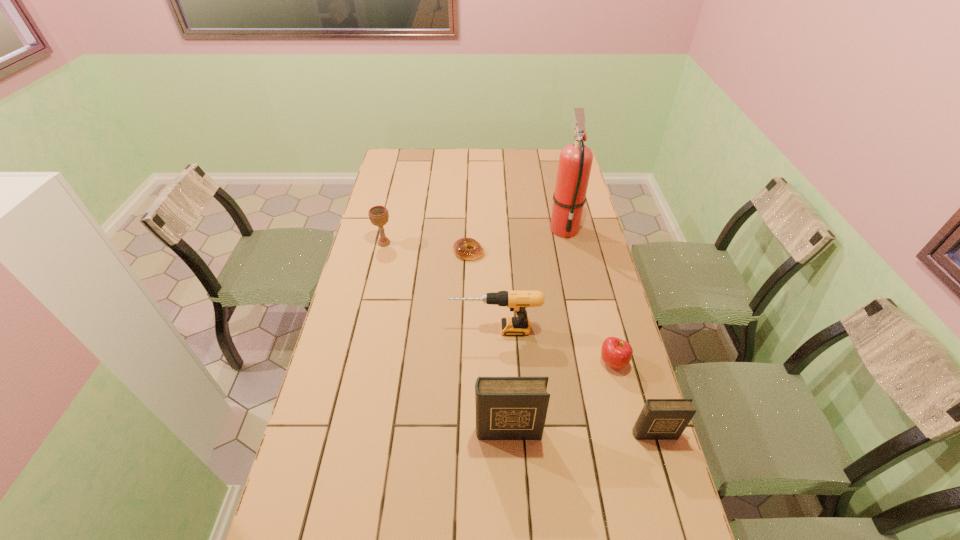
Image resolution: width=960 pixels, height=540 pixels. Identify the location of free space located on the front cover of the right diary. (682, 528).

Image resolution: width=960 pixels, height=540 pixels. Identify the location of vacant space located 0.160m on the right of the bagel. (526, 252).

Locate an element on the screen. free spot located on the hose direction of the tallest object is located at coordinates (585, 321).

Locate an element on the screen. free space located on the right of the chalice is located at coordinates (470, 243).

You are a GUI agent. You are given a task and a screenshot of the screen. Output one action in this format:
    pyautogui.click(x=<x>, y=<y>)
    Task: Click on the free space located on the back of the second shortest object
    
    Given the screenshot: What is the action you would take?
    pyautogui.click(x=603, y=322)

You are a GUI agent. You are given a task and a screenshot of the screen. Output one action in this format:
    pyautogui.click(x=<x>, y=<y>)
    Task: Click on the free space located 0.240m on the handle side of the fourth nearest object
    Image resolution: width=960 pixels, height=540 pixels.
    Given the screenshot: What is the action you would take?
    pyautogui.click(x=375, y=329)

The height and width of the screenshot is (540, 960). Identify the location of vacant region located 0.130m on the handle side of the fourth nearest object. (409, 329).

Where is `free space located 0.100m on the handle side of the fourth nearest object`? This screenshot has height=540, width=960. free space located 0.100m on the handle side of the fourth nearest object is located at coordinates (419, 329).

Locate an element on the screen. This screenshot has width=960, height=540. object that is at the left edge is located at coordinates (378, 215).

The width and height of the screenshot is (960, 540). What are the coordinates of `diary at the right edge` in the screenshot? It's located at (660, 419).